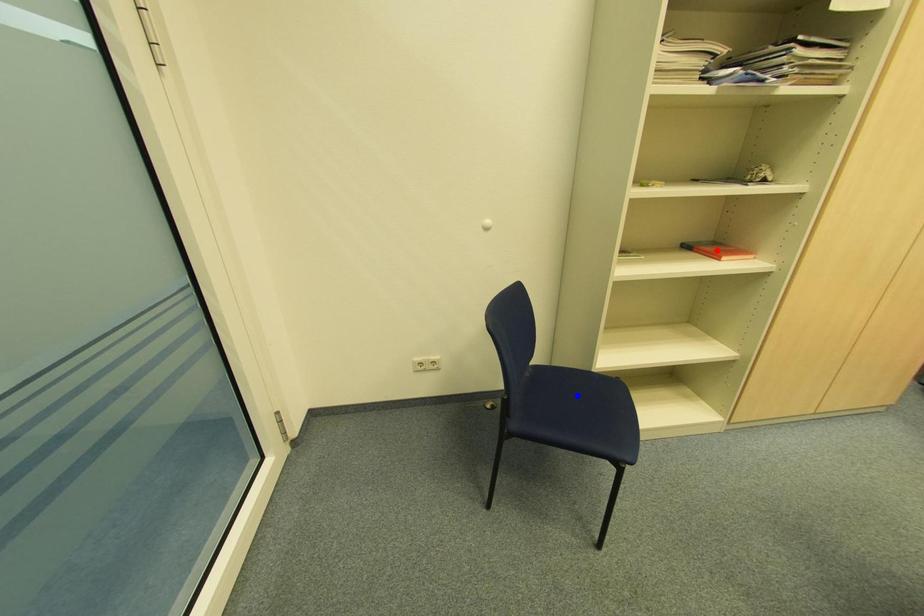
Question: Two points are marked on the image. Which point is closer to the camera?

Choices:
 (A) Blue point is closer.
 (B) Red point is closer.

Answer: (A)